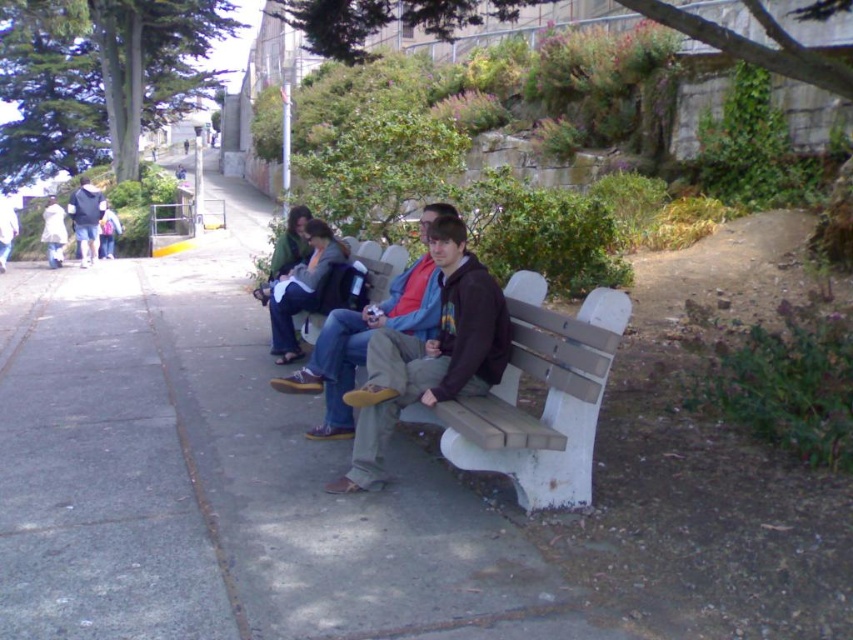
Consider the image. You are standing at the camera position and want to hand a jacket to someone sitting on the bench. The matte brown jacket at center is the one you need to reach. Can you comfortably reach it without moving from your current position?

The matte brown jacket at center is 3.95 meters away from the camera. Since the average comfortable reaching distance for most people is around 2 meters, you would not be able to comfortably reach the jacket without moving closer.

You are standing at the position of point (291, 280) and want to walk towards the wooden bench. Which direction should you move relative to point (361, 355)?

You should move towards point (361, 355) because it is in front of point (291, 280), so moving towards it will lead you toward the bench.

You are organizing a charity clothing drive and need to pack jackets into boxes. The box you have can only hold one jacket at a time. If you have to choose between the matte brown jacket at center and the dark brown leather jacket at center, which jacket would require a smaller box?

The matte brown jacket at center requires a smaller box because it occupies less space than the dark brown leather jacket at center.